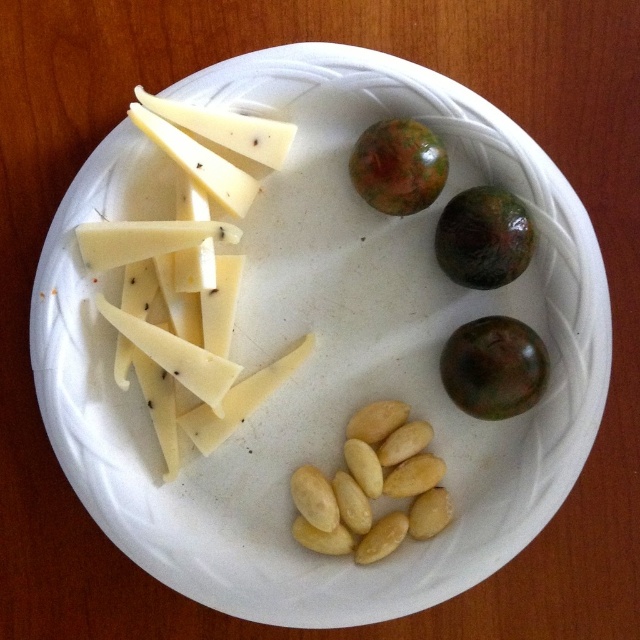
Question: Does yellow cheese at upper left have a smaller size compared to green marble ball at upper center?

Choices:
 (A) no
 (B) yes

Answer: (A)

Question: Does yellow matte almonds at lower center appear on the right side of green marble ball at upper center?

Choices:
 (A) yes
 (B) no

Answer: (B)

Question: Which point appears closest to the camera in this image?

Choices:
 (A) (448, 500)
 (B) (381, 145)
 (C) (468, 225)

Answer: (C)

Question: Is yellow cheese at upper left bigger than green marble-like fruit at lower right?

Choices:
 (A) no
 (B) yes

Answer: (B)

Question: Which object appears farthest from the camera in this image?

Choices:
 (A) green marble ball at upper center
 (B) yellow matte almonds at lower center
 (C) green matte passion fruit at upper right
 (D) green marble-like fruit at lower right

Answer: (B)

Question: Which is farther from the green marble-like fruit at lower right?

Choices:
 (A) green marble ball at upper center
 (B) green matte passion fruit at upper right
 (C) yellow matte almonds at lower center
 (D) yellow cheese at upper left

Answer: (D)